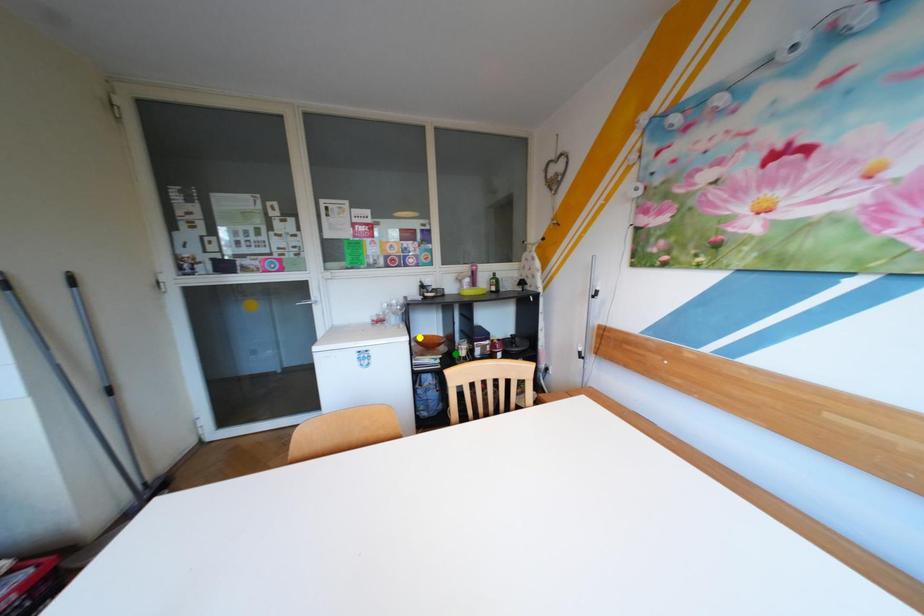
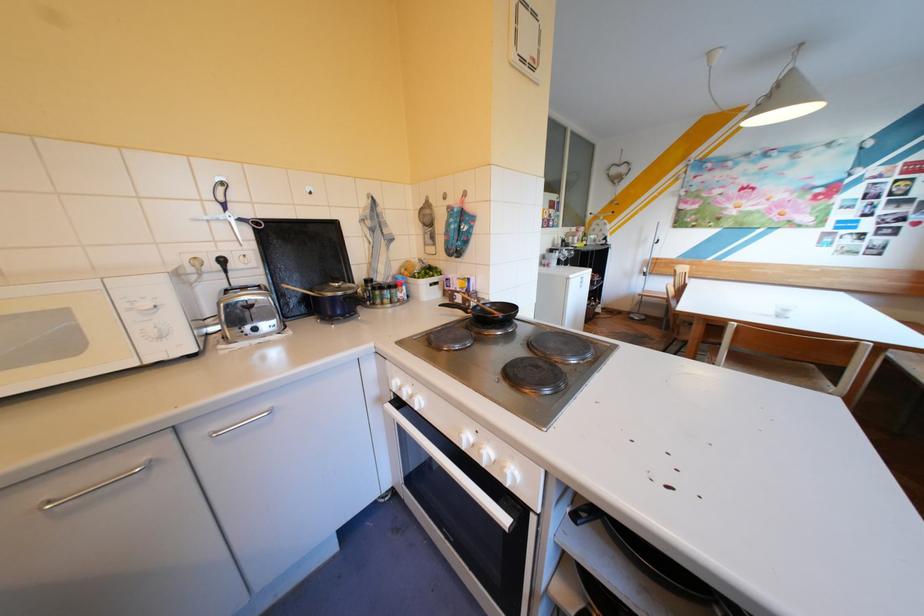
I am providing you with two images of the same scene from different viewpoints. Three points are marked in image1. Which point corresponds to a part or object that is occluded in image2?In image1, three points are marked. Which of them correspond to a part or object that is occluded in image2?Among the three points shown in image1, which one corresponds to a part or object that is no longer visible due to occlusion in image2?

green point, blue point, yellow point